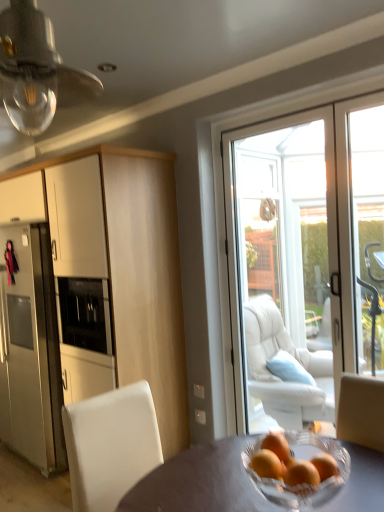
Question: Does orange matte at center have a larger size compared to clear glass bulb at upper left?

Choices:
 (A) no
 (B) yes

Answer: (A)

Question: Is orange matte at center oriented towards clear glass bulb at upper left?

Choices:
 (A) no
 (B) yes

Answer: (A)

Question: From a real-world perspective, is orange matte at center physically above clear glass bulb at upper left?

Choices:
 (A) yes
 (B) no

Answer: (B)

Question: Is orange matte at center to the right of clear glass bulb at upper left from the viewer's perspective?

Choices:
 (A) yes
 (B) no

Answer: (A)

Question: Does orange matte at center come behind clear glass bulb at upper left?

Choices:
 (A) no
 (B) yes

Answer: (B)

Question: Looking at their shapes, would you say white leather chair at lower left is wider or thinner than matte gray table at center?

Choices:
 (A) wide
 (B) thin

Answer: (B)

Question: Choose the correct answer: Is white leather chair at lower left inside matte gray table at center or outside it?

Choices:
 (A) inside
 (B) outside

Answer: (B)

Question: From a real-world perspective, relative to matte gray table at center, is white leather chair at lower left vertically above or below?

Choices:
 (A) above
 (B) below

Answer: (A)

Question: Considering their positions, is white leather chair at lower left located in front of or behind matte gray table at center?

Choices:
 (A) front
 (B) behind

Answer: (B)

Question: Relative to orange matte at center, is matte white cabinet at left in front or behind?

Choices:
 (A) front
 (B) behind

Answer: (B)

Question: Considering the relative positions of matte white cabinet at left and orange matte at center in the image provided, is matte white cabinet at left to the left or to the right of orange matte at center?

Choices:
 (A) left
 (B) right

Answer: (A)

Question: From the image's perspective, is matte white cabinet at left positioned above or below orange matte at center?

Choices:
 (A) below
 (B) above

Answer: (B)

Question: Considering the positions of matte white cabinet at left and orange matte at center in the image, is matte white cabinet at left wider or thinner than orange matte at center?

Choices:
 (A) thin
 (B) wide

Answer: (B)

Question: From a real-world perspective, relative to matte white cabinet at left, is clear glass bulb at upper left vertically above or below?

Choices:
 (A) above
 (B) below

Answer: (A)

Question: Considering their positions, is clear glass bulb at upper left located in front of or behind matte white cabinet at left?

Choices:
 (A) behind
 (B) front

Answer: (B)